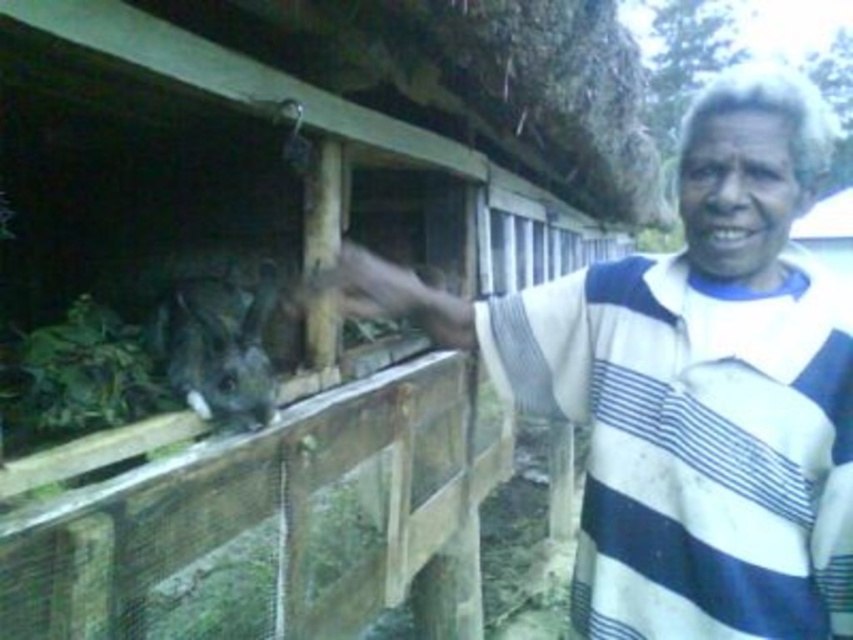
You are a photographer trying to capture a closeup of the white striped shirt at center and the furry gray rabbit at center in the scene. Given that your camera can only focus on subjects within 18 inches of each other, will both subjects be in focus?

The white striped shirt at center and the furry gray rabbit at center are 18.42 inches apart from each other, which exceeds the 18 inch focus range. Therefore, both subjects cannot be in focus simultaneously.

You are a photographer trying to capture a clear shot of the white striped shirt at center and the furry gray rabbit at center. Since the lighting is dim, you need to adjust your camera settings. Which object should you focus on first to ensure proper exposure?

The white striped shirt at center is positioned under furry gray rabbit at center. Therefore, you should focus on the white striped shirt at center first because it is closer to the camera and requires proper exposure before adjusting for the rabbit above it.

You are a photographer trying to capture a clear photo of the furry gray rabbit at center. The white striped shirt at center is blocking part of the view. Can you estimate if the shirt is wider than the rabbit to know how much you need to move it aside?

The white striped shirt at center is larger in width than the furry gray rabbit at center, so you need to move the shirt aside more to fully reveal the rabbit.